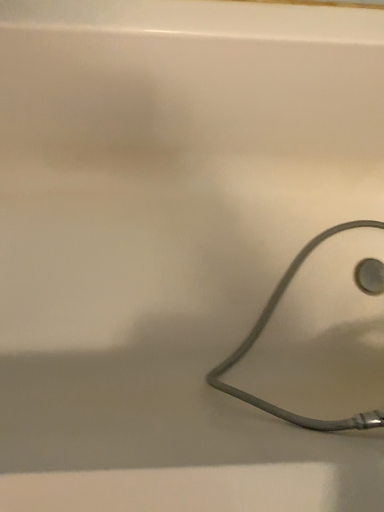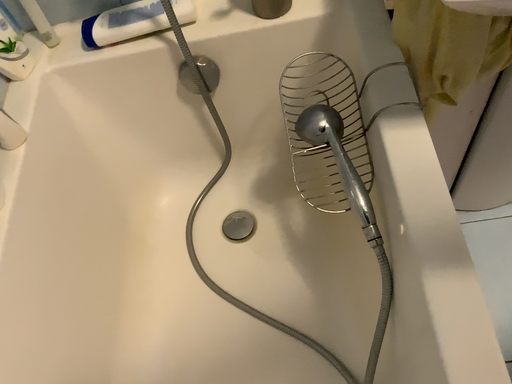
Question: How did the camera likely rotate when shooting the video?

Choices:
 (A) rotated downward
 (B) rotated upward

Answer: (B)